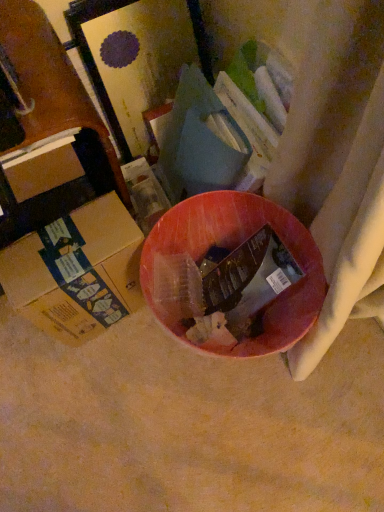
Image resolution: width=384 pixels, height=512 pixels. What do you see at coordinates (43, 169) in the screenshot? I see `brown cardboard box at left, the 2th box ordered from the bottom` at bounding box center [43, 169].

Locate an element on the screen. Image resolution: width=384 pixels, height=512 pixels. brown cardboard box at left, the 1th box positioned from the top is located at coordinates (43, 169).

What is the approximate height of brown cardboard box at left, the 2th box ordered from the bottom?

brown cardboard box at left, the 2th box ordered from the bottom, is 5.56 inches tall.

What do you see at coordinates (77, 271) in the screenshot? I see `brown cardboard box at lower left, which is the first box from bottom to top` at bounding box center [77, 271].

Identify the location of brown cardboard box at lower left, the second box positioned from the top. (77, 271).

In order to face brown cardboard box at lower left, which is the first box from bottom to top, should I rotate leftwards or rightwards?

It's best to rotate left around 13.564 degrees.

Find the location of a particular element. brown cardboard box at left, the 1th box positioned from the top is located at coordinates coord(43,169).

Is brown cardboard box at left, the 1th box positioned from the top, to the right of brown cardboard box at lower left, which is the first box from bottom to top, from the viewer's perspective?

In fact, brown cardboard box at left, the 1th box positioned from the top, is to the left of brown cardboard box at lower left, which is the first box from bottom to top.

Between brown cardboard box at left, the 2th box ordered from the bottom, and brown cardboard box at lower left, which is the first box from bottom to top, which one is positioned in front?

brown cardboard box at lower left, which is the first box from bottom to top, is in front.

Which point is more forward, (36, 154) or (41, 305)?

Point (41, 305)

From the image's perspective, is brown cardboard box at left, the 1th box positioned from the top, below brown cardboard box at lower left, which is the first box from bottom to top?

No, from the image's perspective, brown cardboard box at left, the 1th box positioned from the top, is not below brown cardboard box at lower left, which is the first box from bottom to top.

From a real-world perspective, is brown cardboard box at left, the 2th box ordered from the bottom, on top of brown cardboard box at lower left, which is the first box from bottom to top?

Correct, in the physical world, brown cardboard box at left, the 2th box ordered from the bottom, is higher than brown cardboard box at lower left, which is the first box from bottom to top.

Between brown cardboard box at left, the 2th box ordered from the bottom, and brown cardboard box at lower left, which is the first box from bottom to top, which one has larger width?

Wider between the two is brown cardboard box at lower left, which is the first box from bottom to top.

Considering the relative sizes of brown cardboard box at left, the 1th box positioned from the top, and brown cardboard box at lower left, which is the first box from bottom to top, in the image provided, is brown cardboard box at left, the 1th box positioned from the top, shorter than brown cardboard box at lower left, which is the first box from bottom to top,?

Yes.

Does brown cardboard box at left, the 2th box ordered from the bottom, have a smaller size compared to brown cardboard box at lower left, the second box positioned from the top?

Correct, brown cardboard box at left, the 2th box ordered from the bottom, occupies less space than brown cardboard box at lower left, the second box positioned from the top.

Which is correct: brown cardboard box at left, the 1th box positioned from the top, is inside brown cardboard box at lower left, which is the first box from bottom to top, or outside of it?

brown cardboard box at left, the 1th box positioned from the top, is not enclosed by brown cardboard box at lower left, which is the first box from bottom to top.

Are brown cardboard box at left, the 2th box ordered from the bottom, and brown cardboard box at lower left, the second box positioned from the top, far apart?

brown cardboard box at left, the 2th box ordered from the bottom, is near brown cardboard box at lower left, the second box positioned from the top, not far away.

Could you tell me if brown cardboard box at left, the 2th box ordered from the bottom, is turned towards brown cardboard box at lower left, which is the first box from bottom to top?

Yes.

Locate an element on the screen. This screenshot has height=512, width=384. box below the brown cardboard box at left, the 2th box ordered from the bottom (from the image's perspective) is located at coordinates (77, 271).

Does brown cardboard box at lower left, the second box positioned from the top, appear on the right side of brown cardboard box at left, the 2th box ordered from the bottom?

Yes, brown cardboard box at lower left, the second box positioned from the top, is to the right of brown cardboard box at left, the 2th box ordered from the bottom.

Is the depth of brown cardboard box at lower left, the second box positioned from the top, less than that of brown cardboard box at left, the 2th box ordered from the bottom?

Yes, it is.

Is point (30, 273) more distant than point (51, 151)?

No.

From the image's perspective, is brown cardboard box at lower left, which is the first box from bottom to top, positioned above or below brown cardboard box at left, the 1th box positioned from the top?

From the image's perspective, brown cardboard box at lower left, which is the first box from bottom to top, appears below brown cardboard box at left, the 1th box positioned from the top.

From a real-world perspective, who is located lower, brown cardboard box at lower left, the second box positioned from the top, or brown cardboard box at left, the 1th box positioned from the top?

In real-world perspective, brown cardboard box at lower left, the second box positioned from the top, is lower.

Does brown cardboard box at lower left, which is the first box from bottom to top, have a lesser width compared to brown cardboard box at left, the 2th box ordered from the bottom?

No.

Who is shorter, brown cardboard box at lower left, which is the first box from bottom to top, or brown cardboard box at left, the 1th box positioned from the top?

brown cardboard box at left, the 1th box positioned from the top.

Can you confirm if brown cardboard box at lower left, which is the first box from bottom to top, is bigger than brown cardboard box at left, the 1th box positioned from the top?

Indeed, brown cardboard box at lower left, which is the first box from bottom to top, has a larger size compared to brown cardboard box at left, the 1th box positioned from the top.

Is brown cardboard box at lower left, the second box positioned from the top, not inside brown cardboard box at left, the 2th box ordered from the bottom?

Yes, brown cardboard box at lower left, the second box positioned from the top, is outside of brown cardboard box at left, the 2th box ordered from the bottom.

Is brown cardboard box at lower left, the second box positioned from the top, beside brown cardboard box at left, the 1th box positioned from the top?

brown cardboard box at lower left, the second box positioned from the top, and brown cardboard box at left, the 1th box positioned from the top, are not in contact.

Is brown cardboard box at lower left, which is the first box from bottom to top, positioned with its back to brown cardboard box at left, the 2th box ordered from the bottom?

That's right, brown cardboard box at lower left, which is the first box from bottom to top, is facing away from brown cardboard box at left, the 2th box ordered from the bottom.

How many degrees apart are the facing directions of brown cardboard box at lower left, the second box positioned from the top, and brown cardboard box at left, the 2th box ordered from the bottom?

5.21 degrees separate the facing orientations of brown cardboard box at lower left, the second box positioned from the top, and brown cardboard box at left, the 2th box ordered from the bottom.

Where is `box on the right of brown cardboard box at left, the 2th box ordered from the bottom`? The image size is (384, 512). box on the right of brown cardboard box at left, the 2th box ordered from the bottom is located at coordinates (77, 271).

Where is `box that is below the brown cardboard box at left, the 1th box positioned from the top (from the image's perspective)`? The image size is (384, 512). box that is below the brown cardboard box at left, the 1th box positioned from the top (from the image's perspective) is located at coordinates (77, 271).

This screenshot has width=384, height=512. I want to click on box in front of the brown cardboard box at left, the 1th box positioned from the top, so click(x=77, y=271).